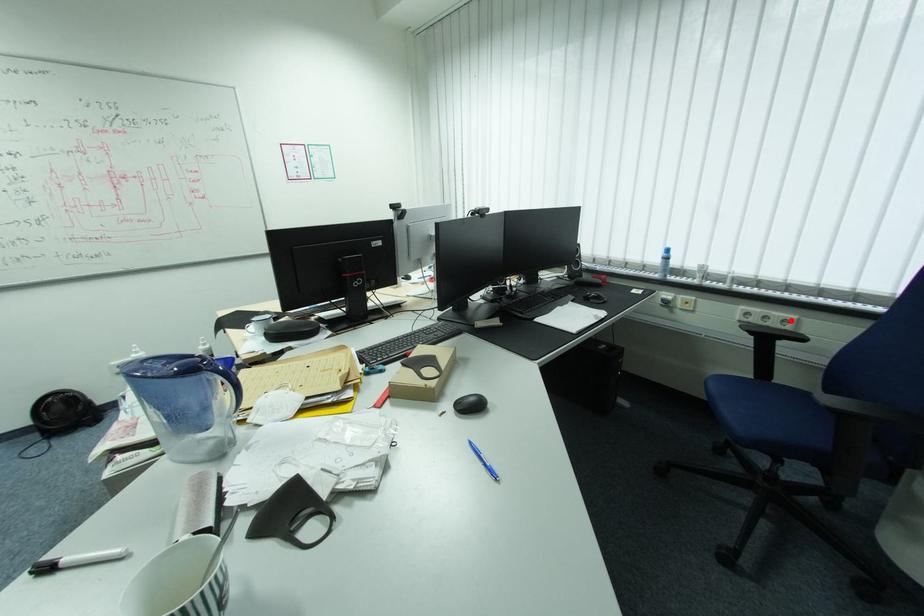
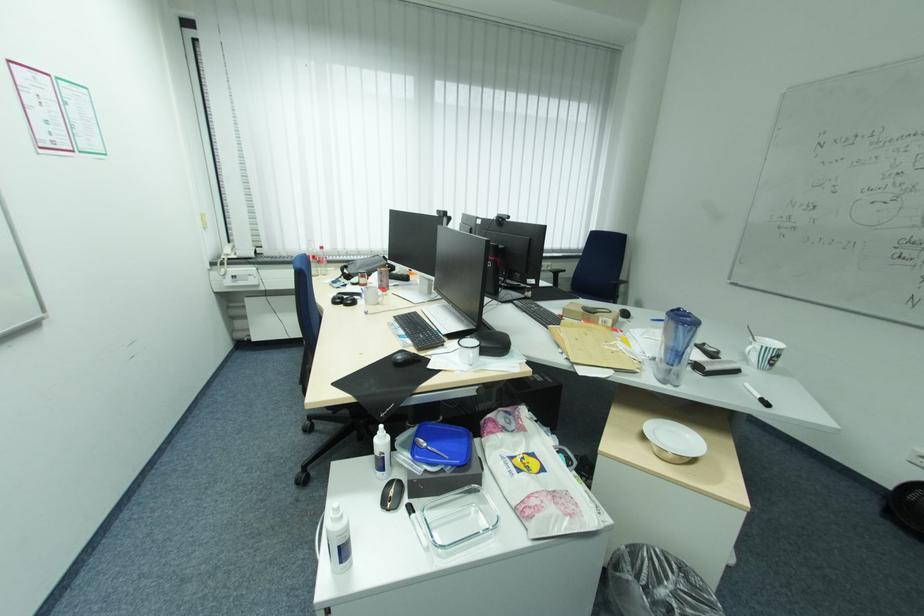
Question: I am providing you with two images of the same scene from different viewpoints. In image1, a red point is highlighted. Considering the same 3D point in image2, which of the following is correct?

Choices:
 (A) It is closer
 (B) It is farther

Answer: (B)